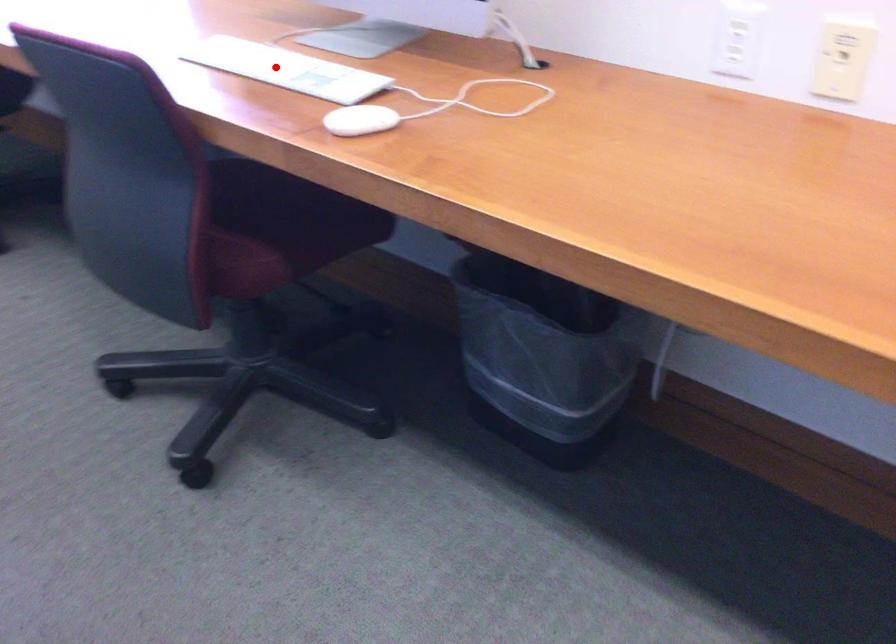
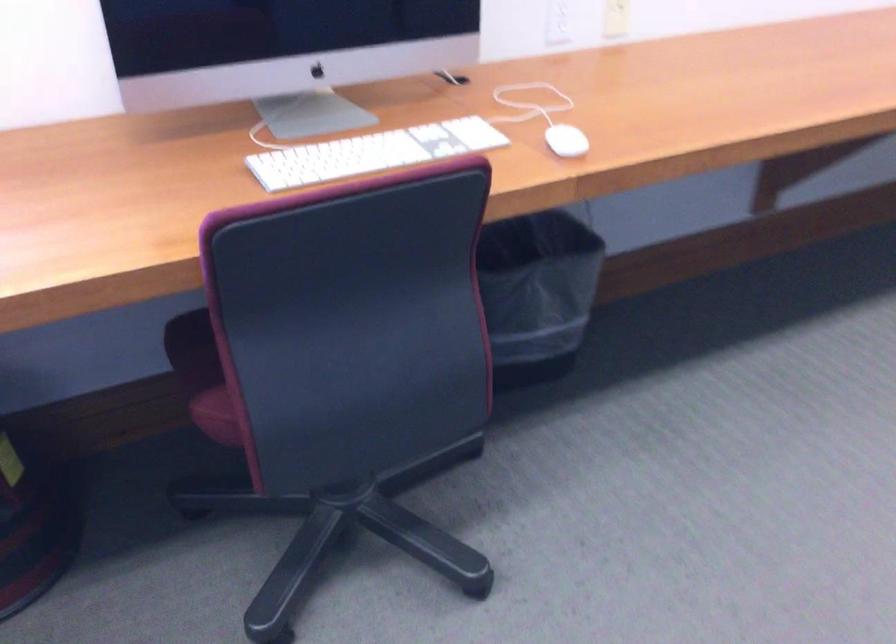
Where in the second image is the point corresponding to the highlighted location from the first image?

(372, 153)